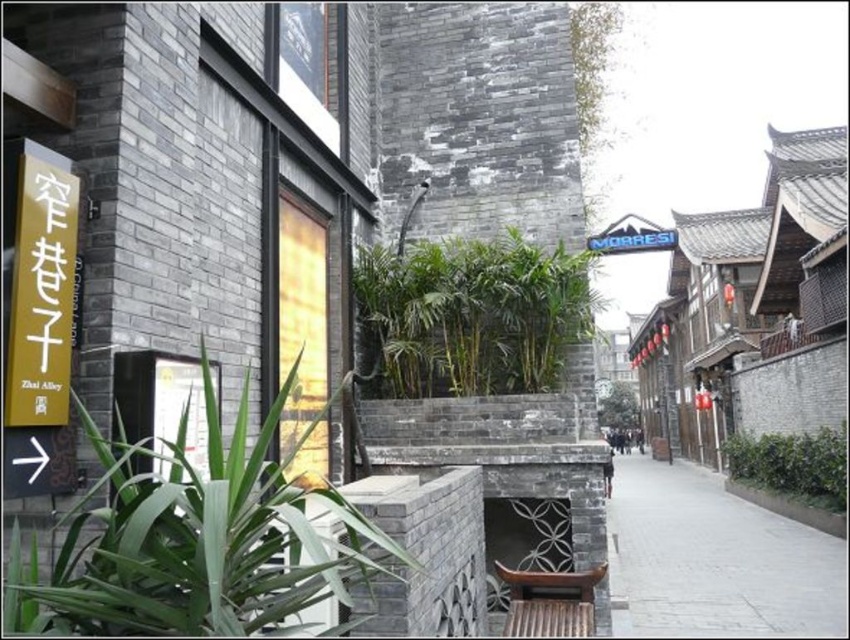
You are standing in the narrow alleyway of Zhai Alley and notice a green leafy plant at left. If you want to take a photo of it from the entrance of the alley, which direction should you aim your camera?

The green leafy plant at left is located at point [194,540], which means it is positioned to the far left and slightly forward in the scene. To capture it from the entrance, aim your camera towards the left side of the alleyway near the entrance area.

Based on the photo, you are a delivery person with a 1.2 meter wide cart. You need to navigate through the narrow alleyway shown in the image. The alleyway has a green leafy plant at left and a gray concrete pavement at lower right. Can your cart pass through the narrowest part between these two objects?

The green leafy plant at left is thinner than the gray concrete pavement at lower right, but the description does not provide specific measurements of the narrowest part. Without knowing the exact width of the path between them, it is impossible to determine if the 1.2 meter wide cart can pass through safely.

You are a tourist walking along the alleyway and want to take a photo of both the green leafy plant at center and the green leafy bush at lower right. Which direction should you face to ensure both are in your frame?

To capture both the green leafy plant at center and the green leafy bush at lower right in your photo, you should face to the left since the green leafy plant at center is positioned to the left of the green leafy bush at lower right.